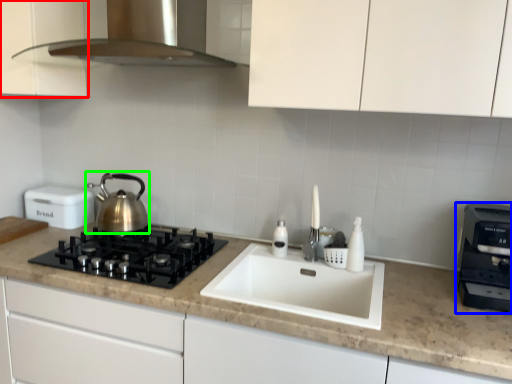
Question: Which object is the farthest from cabinetry (highlighted by a red box)? Choose among these: kitchen appliance (highlighted by a blue box) or kettle (highlighted by a green box).

Choices:
 (A) kitchen appliance
 (B) kettle

Answer: (A)